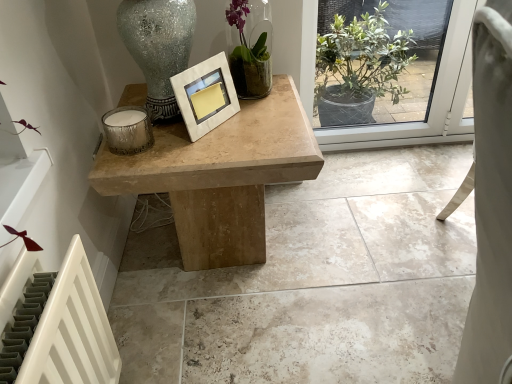
Locate an element on the screen. The width and height of the screenshot is (512, 384). vacant area located to the right-hand side of green glass vase at upper center is located at coordinates (284, 91).